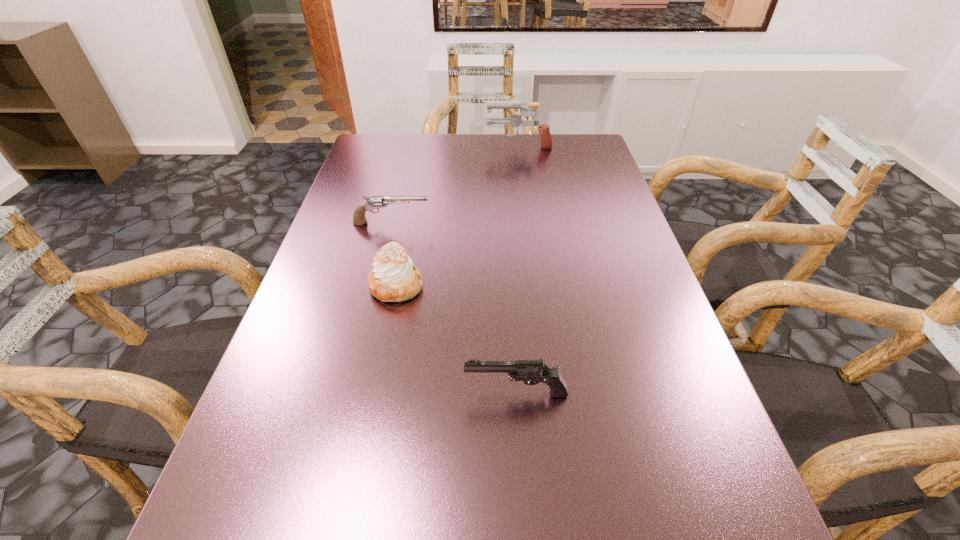
In order to click on vacant area in the image that satisfies the following two spatial constraints: 1. on the back side of the pastry; 2. aiming along the barrel of the leftmost gun in this screenshot , I will do `click(409, 223)`.